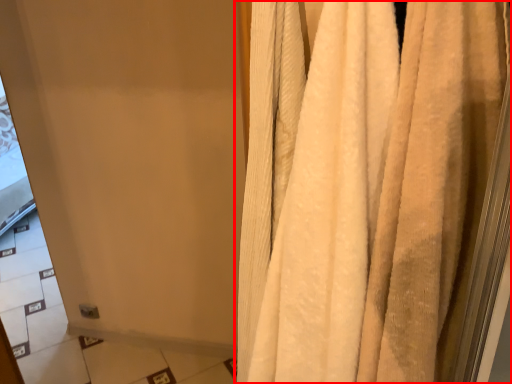
Question: From the image's perspective, what is the correct spatial positioning of curtain (annotated by the red box) in reference to screen door?

Choices:
 (A) below
 (B) above

Answer: (B)